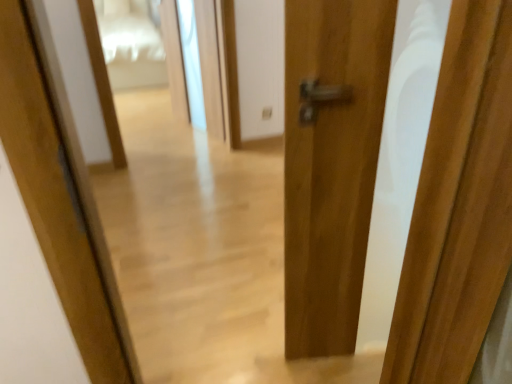
What are the coordinates of `transparent glass screen door at center` in the screenshot? It's located at (202, 64).

Measure the distance between transparent glass screen door at center and camera.

transparent glass screen door at center is 3.02 meters away from camera.

What do you see at coordinates (202, 64) in the screenshot?
I see `transparent glass screen door at center` at bounding box center [202, 64].

Find the location of a particular element. Image resolution: width=512 pixels, height=384 pixels. matte wood door at center is located at coordinates (331, 163).

Describe the element at coordinates (331, 163) in the screenshot. I see `matte wood door at center` at that location.

Identify the location of transparent glass screen door at center. This screenshot has height=384, width=512. (202, 64).

Consider the image. Considering the relative positions of matte wood door at center and transparent glass screen door at center in the image provided, is matte wood door at center to the left or to the right of transparent glass screen door at center?

Clearly, matte wood door at center is on the right of transparent glass screen door at center in the image.

Which object is further away from the camera taking this photo, matte wood door at center or transparent glass screen door at center?

transparent glass screen door at center is more distant.

Which point is more distant from viewer, (367, 181) or (188, 14)?

Positioned behind is point (188, 14).

From the image's perspective, which one is positioned higher, matte wood door at center or transparent glass screen door at center?

transparent glass screen door at center appears higher in the image.

From a real-world perspective, between matte wood door at center and transparent glass screen door at center, who is vertically lower?

In real-world perspective, transparent glass screen door at center is lower.

Which object is thinner, matte wood door at center or transparent glass screen door at center?

transparent glass screen door at center is thinner.

Consider the image. Between matte wood door at center and transparent glass screen door at center, which one has more height?

With more height is matte wood door at center.

Considering the sizes of matte wood door at center and transparent glass screen door at center in the image, is matte wood door at center bigger or smaller than transparent glass screen door at center?

matte wood door at center is bigger than transparent glass screen door at center.

In the scene shown: Is transparent glass screen door at center inside matte wood door at center?

No, transparent glass screen door at center is located outside of matte wood door at center.

Is matte wood door at center in contact with transparent glass screen door at center?

No, matte wood door at center is not touching transparent glass screen door at center.

Is matte wood door at center positioned with its back to transparent glass screen door at center?

Yes.

This screenshot has width=512, height=384. In order to click on screen door behind the matte wood door at center in this screenshot , I will do `click(202, 64)`.

Is transparent glass screen door at center to the left or to the right of matte wood door at center in the image?

transparent glass screen door at center is to the left of matte wood door at center.

Is transparent glass screen door at center further to the viewer compared to matte wood door at center?

Yes, transparent glass screen door at center is further from the camera.

Between point (187, 44) and point (332, 8), which one is positioned behind?

The point (187, 44) is more distant.

From the image's perspective, is transparent glass screen door at center beneath matte wood door at center?

No, from the image's perspective, transparent glass screen door at center is not below matte wood door at center.

Based on the photo, from a real-world perspective, is transparent glass screen door at center located beneath matte wood door at center?

Correct, in the physical world, transparent glass screen door at center is lower than matte wood door at center.

Considering the sizes of transparent glass screen door at center and matte wood door at center in the image, is transparent glass screen door at center wider or thinner than matte wood door at center?

Considering their sizes, transparent glass screen door at center looks slimmer than matte wood door at center.

Considering the relative sizes of transparent glass screen door at center and matte wood door at center in the image provided, is transparent glass screen door at center shorter than matte wood door at center?

Correct, transparent glass screen door at center is not as tall as matte wood door at center.

From the picture: Considering the sizes of objects transparent glass screen door at center and matte wood door at center in the image provided, who is smaller, transparent glass screen door at center or matte wood door at center?

transparent glass screen door at center is smaller.

Do you think transparent glass screen door at center is within matte wood door at center, or outside of it?

transparent glass screen door at center is not inside matte wood door at center, it's outside.

Is there a large distance between transparent glass screen door at center and matte wood door at center?

Yes, transparent glass screen door at center is far from matte wood door at center.

Does transparent glass screen door at center turn towards matte wood door at center?

Yes.

The height and width of the screenshot is (384, 512). I want to click on screen door above the matte wood door at center (from the image's perspective), so click(x=202, y=64).

The height and width of the screenshot is (384, 512). Find the location of `screen door above the matte wood door at center (from the image's perspective)`. screen door above the matte wood door at center (from the image's perspective) is located at coordinates (202, 64).

Image resolution: width=512 pixels, height=384 pixels. Find the location of `screen door that appears behind the matte wood door at center`. screen door that appears behind the matte wood door at center is located at coordinates (202, 64).